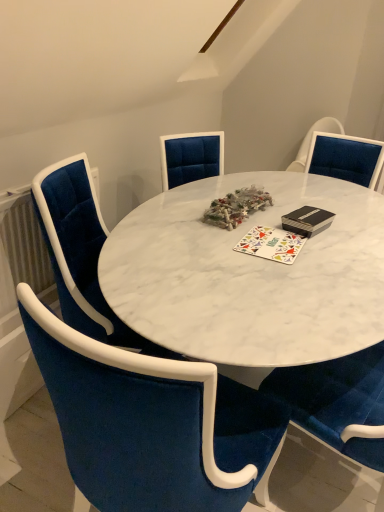
Question: Does velvet blue chair at left, the 1th chair in the back-to-front sequence, have a lesser height compared to multicolored fabric mat at center?

Choices:
 (A) yes
 (B) no

Answer: (B)

Question: Are velvet blue chair at left, the 2th chair when ordered from front to back, and multicolored fabric mat at center far apart?

Choices:
 (A) yes
 (B) no

Answer: (B)

Question: Is velvet blue chair at left, the 1th chair in the back-to-front sequence, in front of multicolored fabric mat at center?

Choices:
 (A) no
 (B) yes

Answer: (B)

Question: Is velvet blue chair at left, the 2th chair when ordered from front to back, at the right side of multicolored fabric mat at center?

Choices:
 (A) yes
 (B) no

Answer: (B)

Question: Is velvet blue chair at left, the 2th chair when ordered from front to back, positioned with its back to multicolored fabric mat at center?

Choices:
 (A) no
 (B) yes

Answer: (A)

Question: Is point (87, 445) positioned closer to the camera than point (286, 250)?

Choices:
 (A) farther
 (B) closer

Answer: (B)

Question: In the image, is velvet blue chair at center, the 2th chair positioned from the back, positioned in front of or behind multicolored fabric mat at center?

Choices:
 (A) behind
 (B) front

Answer: (B)

Question: Is velvet blue chair at center, the 2th chair positioned from the back, spatially inside multicolored fabric mat at center, or outside of it?

Choices:
 (A) inside
 (B) outside

Answer: (B)

Question: In the image, is velvet blue chair at center, the 2th chair positioned from the back, on the left side or the right side of multicolored fabric mat at center?

Choices:
 (A) right
 (B) left

Answer: (B)

Question: From a real-world perspective, is multicolored fabric mat at center positioned above or below velvet blue chair at left, the 1th chair in the back-to-front sequence?

Choices:
 (A) above
 (B) below

Answer: (A)

Question: Is point (299, 244) positioned closer to the camera than point (67, 232)?

Choices:
 (A) closer
 (B) farther

Answer: (A)

Question: Looking at their shapes, would you say multicolored fabric mat at center is wider or thinner than velvet blue chair at left, the 1th chair in the back-to-front sequence?

Choices:
 (A) wide
 (B) thin

Answer: (B)

Question: Would you say multicolored fabric mat at center is to the left or to the right of velvet blue chair at left, the 2th chair when ordered from front to back, in the picture?

Choices:
 (A) left
 (B) right

Answer: (B)

Question: From a real-world perspective, is velvet blue chair at center, positioned as the first chair in front-to-back order, physically located above or below velvet blue chair at left, the 2th chair when ordered from front to back?

Choices:
 (A) above
 (B) below

Answer: (A)

Question: Is velvet blue chair at center, positioned as the first chair in front-to-back order, situated inside velvet blue chair at left, the 2th chair when ordered from front to back, or outside?

Choices:
 (A) outside
 (B) inside

Answer: (A)